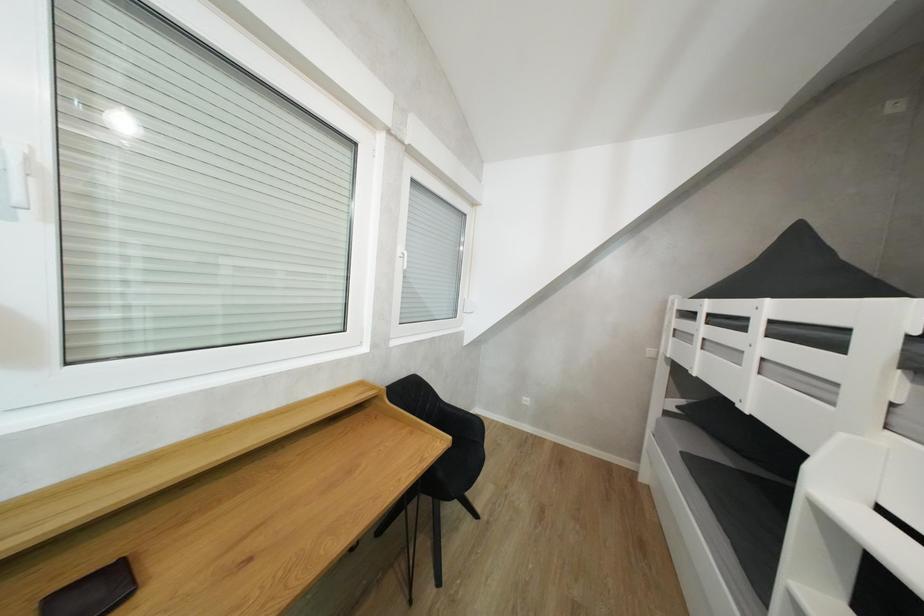
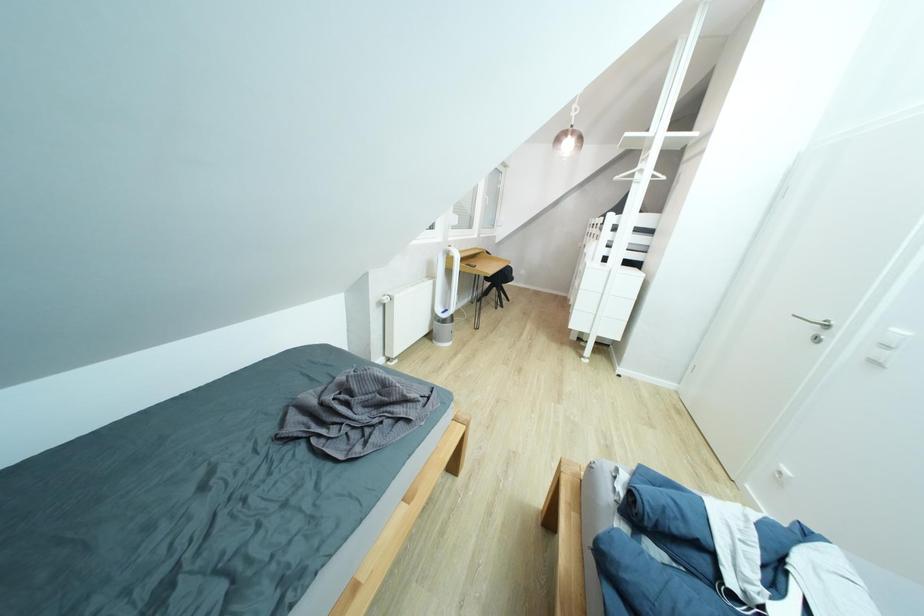
Which direction would the cameraman need to move to produce the second image?

The cameraman moved toward left, backward.